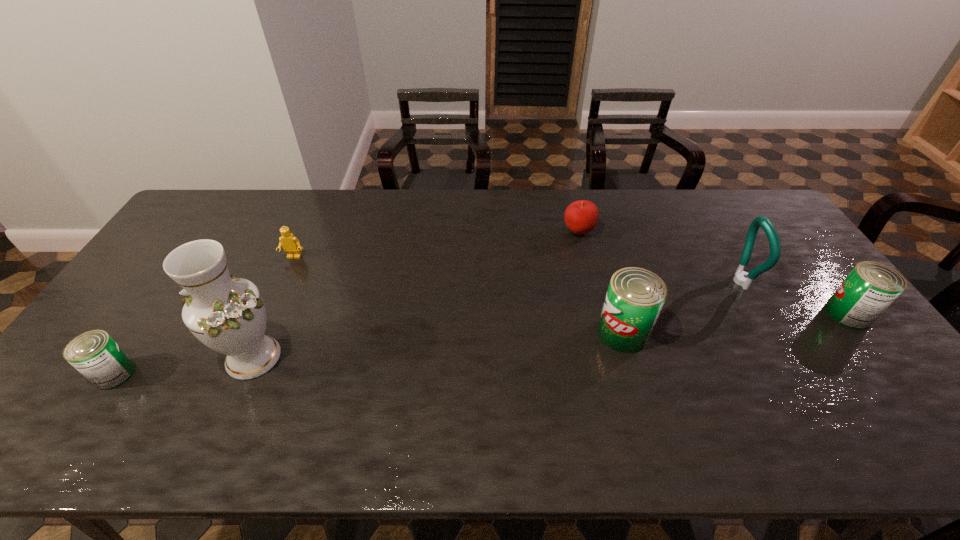
At what (x,y) coordinates should I click in order to perform the action: click on the nearest can. Please return your answer as a coordinate pair (x, y). The height and width of the screenshot is (540, 960). Looking at the image, I should click on pyautogui.click(x=94, y=354).

I want to click on the shortest can, so click(x=94, y=354).

What are the coordinates of `the second can from left to right` in the screenshot? It's located at (635, 296).

Find the location of a particular element. Image resolution: width=960 pixels, height=540 pixels. the tallest can is located at coordinates (635, 296).

Locate an element on the screen. Image resolution: width=960 pixels, height=540 pixels. the fourth tallest object is located at coordinates (870, 288).

I want to click on the second shortest can, so click(870, 288).

Where is `the farthest object`? the farthest object is located at coordinates (581, 216).

Identify the location of the sixth nearest object. This screenshot has width=960, height=540. (291, 245).

Find the location of a particular element. This screenshot has height=540, width=960. bottle opener is located at coordinates (740, 278).

Find the location of a particular element. This screenshot has height=540, width=960. the second object from right to left is located at coordinates (740, 278).